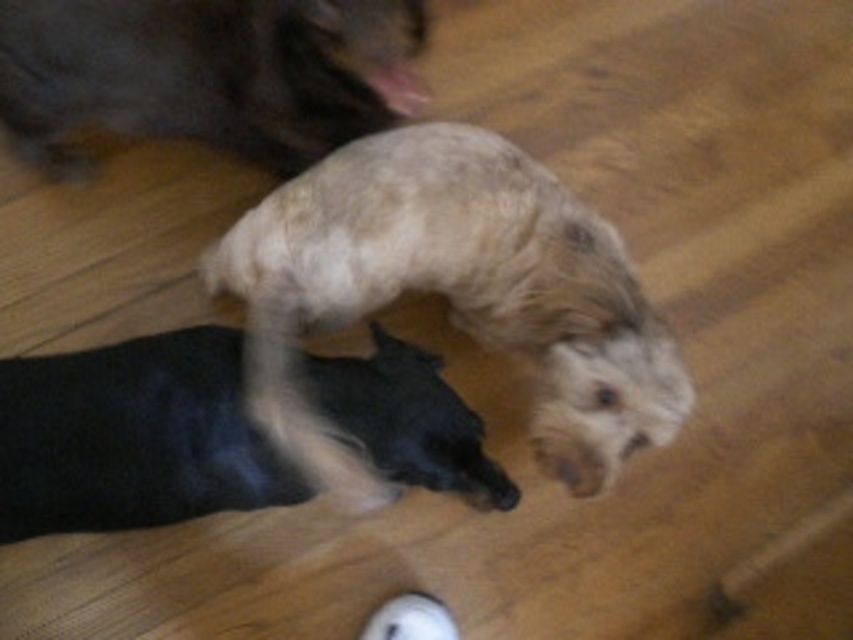
Looking at this image, is fluffy beige dog at center further to camera compared to soft brown fur at upper left?

No, it is not.

Is point (368, 250) farther from camera compared to point (80, 81)?

No, (368, 250) is in front of (80, 81).

Is point (293, 237) in front of point (172, 65)?

Yes, it is.

Where is `fluffy beige dog at center`? fluffy beige dog at center is located at coordinates (451, 296).

Which is more to the left, soft black dog at lower left or soft brown fur at upper left?

soft brown fur at upper left is more to the left.

Does soft black dog at lower left have a lesser width compared to soft brown fur at upper left?

Yes, soft black dog at lower left is thinner than soft brown fur at upper left.

Image resolution: width=853 pixels, height=640 pixels. Find the location of `soft black dog at lower left`. soft black dog at lower left is located at coordinates (132, 436).

The width and height of the screenshot is (853, 640). What are the coordinates of `soft black dog at lower left` in the screenshot? It's located at (132, 436).

Is fluffy beige dog at center shorter than soft black dog at lower left?

Incorrect, fluffy beige dog at center's height does not fall short of soft black dog at lower left's.

Is fluffy beige dog at center to the left of soft black dog at lower left from the viewer's perspective?

In fact, fluffy beige dog at center is to the right of soft black dog at lower left.

Which is in front, point (329, 252) or point (415, 451)?

Point (415, 451) is in front.

Identify the location of fluffy beige dog at center. Image resolution: width=853 pixels, height=640 pixels. (451, 296).